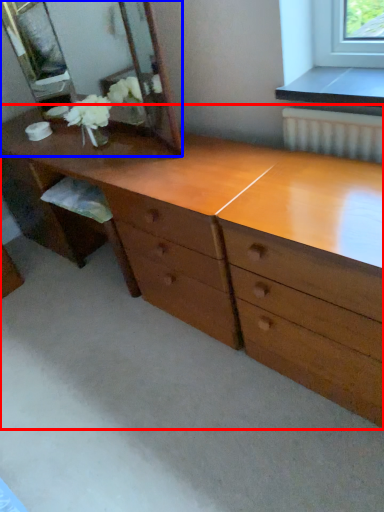
Question: Which point is closer to the camera, chest of drawers (highlighted by a red box) or mirror (highlighted by a blue box)?

Choices:
 (A) chest of drawers
 (B) mirror

Answer: (A)